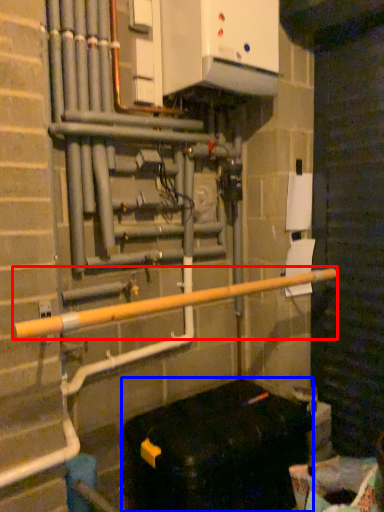
Question: Which object is closer to the camera taking this photo, rail (highlighted by a red box) or furniture (highlighted by a blue box)?

Choices:
 (A) rail
 (B) furniture

Answer: (A)